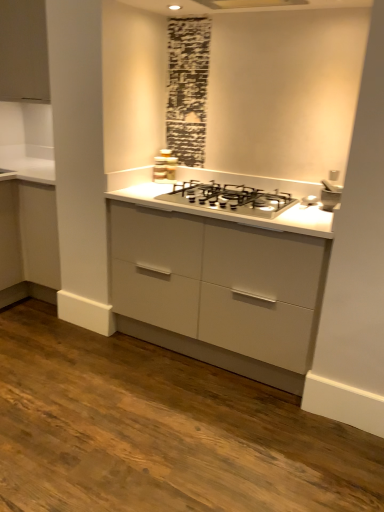
Describe the element at coordinates (164, 166) in the screenshot. I see `satin silver stove at center` at that location.

The width and height of the screenshot is (384, 512). I want to click on white ceramic sink at upper right, so click(x=330, y=195).

Describe the element at coordinates (330, 195) in the screenshot. The height and width of the screenshot is (512, 384). I see `white ceramic sink at upper right` at that location.

What are the coordinates of `matte white cabinet at upper left` in the screenshot? It's located at (23, 51).

Locate an element on the screen. satin silver stove at center is located at coordinates (164, 166).

From a real-world perspective, is satin silver gas stove at center positioned above or below matte white cabinet at upper left?

In terms of real-world spatial position, satin silver gas stove at center is below matte white cabinet at upper left.

The image size is (384, 512). I want to click on gas stove lying below the matte white cabinet at upper left (from the image's perspective), so click(229, 198).

How many degrees apart are the facing directions of satin silver gas stove at center and matte white cabinet at upper left?

The angle between the facing direction of satin silver gas stove at center and the facing direction of matte white cabinet at upper left is 0.274 degrees.

In terms of size, does satin silver gas stove at center appear bigger or smaller than matte white cabinet at upper left?

Considering their sizes, satin silver gas stove at center takes up less space than matte white cabinet at upper left.

From a real-world perspective, who is located lower, matte white cabinet at upper left or satin silver gas stove at center?

satin silver gas stove at center, from a real-world perspective.

Does matte white cabinet at upper left appear on the left side of satin silver gas stove at center?

Yes, matte white cabinet at upper left is to the left of satin silver gas stove at center.

Can you confirm if matte white cabinet at upper left is thinner than satin silver gas stove at center?

Indeed, matte white cabinet at upper left has a lesser width compared to satin silver gas stove at center.

Does matte white cabinet at upper left have a smaller size compared to satin silver gas stove at center?

No.

Which is in front, satin silver gas stove at center or satin silver stove at center?

satin silver gas stove at center is in front.

Is satin silver gas stove at center taller than satin silver stove at center?

In fact, satin silver gas stove at center may be shorter than satin silver stove at center.

From a real-world perspective, relative to satin silver stove at center, is satin silver gas stove at center vertically above or below?

satin silver gas stove at center is situated lower than satin silver stove at center in the real world.

Is point (192, 194) positioned before point (165, 151)?

Yes, it is.

Does point (312, 202) come in front of point (15, 46)?

Yes, it is.

Is white ceramic sink at upper right thinner than matte white cabinet at upper left?

Result: Yes.

From the image's perspective, would you say white ceramic sink at upper right is positioned over matte white cabinet at upper left?

Actually, white ceramic sink at upper right appears below matte white cabinet at upper left in the image.

Is matte white cabinet at upper left at the back of white ceramic sink at upper right?

No, white ceramic sink at upper right's orientation is not away from matte white cabinet at upper left.

Which is nearer, (169,175) or (6,72)?

Clearly, point (169,175) is closer to the camera than point (6,72).

Is matte white cabinet at upper left completely or partially inside satin silver stove at center?

No, matte white cabinet at upper left is located outside of satin silver stove at center.

From their relative heights in the image, would you say satin silver stove at center is taller or shorter than matte white cabinet at upper left?

satin silver stove at center is shorter than matte white cabinet at upper left.

From a real-world perspective, is satin silver stove at center positioned under matte white cabinet at upper left based on gravity?

Yes, from a real-world perspective, satin silver stove at center is under matte white cabinet at upper left.

Looking at their sizes, would you say white ceramic sink at upper right is wider or thinner than satin silver stove at center?

In the image, white ceramic sink at upper right appears to be wider than satin silver stove at center.

Which is behind, point (334, 193) or point (162, 166)?

The point (162, 166) is behind.

Would you consider white ceramic sink at upper right to be distant from satin silver stove at center?

white ceramic sink at upper right is near satin silver stove at center, not far away.

Is white ceramic sink at upper right inside the boundaries of satin silver stove at center, or outside?

white ceramic sink at upper right lies outside satin silver stove at center.

Between white ceramic sink at upper right and satin silver gas stove at center, which one has smaller width?

white ceramic sink at upper right.

From a real-world perspective, who is located higher, white ceramic sink at upper right or satin silver gas stove at center?

white ceramic sink at upper right is physically above.

Who is more distant, white ceramic sink at upper right or satin silver gas stove at center?

Positioned behind is white ceramic sink at upper right.

The height and width of the screenshot is (512, 384). What are the coordinates of `sink above the satin silver gas stove at center (from a real-world perspective)` in the screenshot? It's located at (330, 195).

At what (x,y) coordinates should I click in order to perform the action: click on gas stove in front of the matte white cabinet at upper left. Please return your answer as a coordinate pair (x, y). The width and height of the screenshot is (384, 512). Looking at the image, I should click on (229, 198).

At what (x,y) coordinates should I click in order to perform the action: click on cabinetry that is above the satin silver gas stove at center (from a real-world perspective). Please return your answer as a coordinate pair (x, y). The height and width of the screenshot is (512, 384). Looking at the image, I should click on (23, 51).

Consider the image. Looking at the image, which one is located closer to satin silver stove at center, matte white cabinet at upper left or satin silver gas stove at center?

satin silver gas stove at center is closer to satin silver stove at center.

Considering their positions, is satin silver gas stove at center positioned further to satin silver stove at center than white ceramic sink at upper right?

white ceramic sink at upper right is further to satin silver stove at center.

From the image, which object appears to be farther from white ceramic sink at upper right, satin silver gas stove at center or matte white cabinet at upper left?

The object further to white ceramic sink at upper right is matte white cabinet at upper left.

From the image, which object appears to be nearer to satin silver gas stove at center, satin silver stove at center or matte white cabinet at upper left?

satin silver stove at center.

From the image, which object appears to be farther from matte white cabinet at upper left, satin silver gas stove at center or satin silver stove at center?

Among the two, satin silver gas stove at center is located further to matte white cabinet at upper left.

From the image, which object appears to be nearer to white ceramic sink at upper right, satin silver gas stove at center or satin silver stove at center?

The object closer to white ceramic sink at upper right is satin silver gas stove at center.

Based on their spatial positions, is matte white cabinet at upper left or satin silver stove at center further from white ceramic sink at upper right?

matte white cabinet at upper left is positioned further to the anchor white ceramic sink at upper right.

Considering their positions, is satin silver gas stove at center positioned further to satin silver stove at center than matte white cabinet at upper left?

matte white cabinet at upper left is further to satin silver stove at center.

Image resolution: width=384 pixels, height=512 pixels. Identify the location of gas stove located between satin silver stove at center and white ceramic sink at upper right in the left-right direction. (229, 198).

This screenshot has height=512, width=384. Identify the location of gas stove situated between matte white cabinet at upper left and white ceramic sink at upper right from left to right. (229, 198).

In order to click on appliance between matte white cabinet at upper left and satin silver gas stove at center in the horizontal direction in this screenshot , I will do `click(164, 166)`.

You are a GUI agent. You are given a task and a screenshot of the screen. Output one action in this format:
    pyautogui.click(x=<x>, y=<y>)
    Task: Click on the appliance between matte white cabinet at upper left and white ceramic sink at upper right
    This screenshot has width=384, height=512.
    Given the screenshot: What is the action you would take?
    pyautogui.click(x=164, y=166)